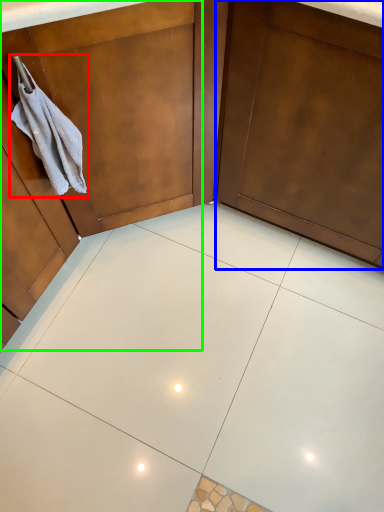
Question: Which object is positioned closest to hand towel (highlighted by a red box)? Select from door (highlighted by a blue box) and dresser (highlighted by a green box).

Choices:
 (A) door
 (B) dresser

Answer: (B)